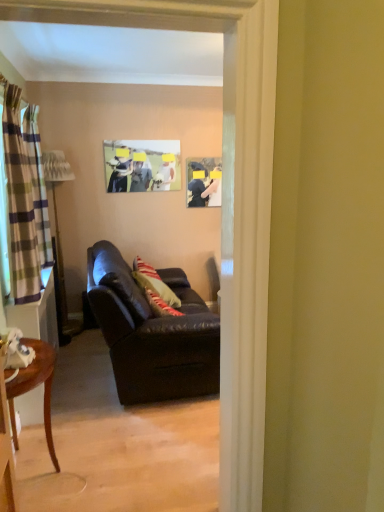
Question: Should I look upward or downward to see matte plastic picture frame at upper center, the second picture frame positioned from the right?

Choices:
 (A) up
 (B) down

Answer: (A)

Question: Is plaid fabric curtain at left, positioned as the 1th curtain in left-to-right order, aimed at mahogany wood side table at lower left?

Choices:
 (A) yes
 (B) no

Answer: (B)

Question: Is plaid fabric curtain at left, which is counted as the 1th curtain, starting from the back, far from mahogany wood side table at lower left?

Choices:
 (A) yes
 (B) no

Answer: (B)

Question: Is plaid fabric curtain at left, positioned as the 2th curtain in front-to-back order, smaller than mahogany wood side table at lower left?

Choices:
 (A) yes
 (B) no

Answer: (A)

Question: From the image's perspective, would you say plaid fabric curtain at left, positioned as the 1th curtain in left-to-right order, is positioned over mahogany wood side table at lower left?

Choices:
 (A) no
 (B) yes

Answer: (B)

Question: Considering the relative sizes of plaid fabric curtain at left, positioned as the 2th curtain in front-to-back order, and mahogany wood side table at lower left in the image provided, is plaid fabric curtain at left, positioned as the 2th curtain in front-to-back order, wider than mahogany wood side table at lower left?

Choices:
 (A) yes
 (B) no

Answer: (B)

Question: Does plaid fabric curtain at left, positioned as the 1th curtain in left-to-right order, come in front of mahogany wood side table at lower left?

Choices:
 (A) yes
 (B) no

Answer: (B)

Question: Is the position of matte plastic picture frame at upper center, the second picture frame positioned from the right, more distant than that of leather couch at center?

Choices:
 (A) no
 (B) yes

Answer: (B)

Question: From a real-world perspective, is matte plastic picture frame at upper center, which is the first picture frame in left-to-right order, positioned over leather couch at center based on gravity?

Choices:
 (A) no
 (B) yes

Answer: (B)

Question: Is matte plastic picture frame at upper center, the second picture frame positioned from the right, aimed at leather couch at center?

Choices:
 (A) yes
 (B) no

Answer: (B)

Question: Considering the relative positions of matte plastic picture frame at upper center, the second picture frame positioned from the right, and leather couch at center in the image provided, is matte plastic picture frame at upper center, the second picture frame positioned from the right, to the right of leather couch at center from the viewer's perspective?

Choices:
 (A) yes
 (B) no

Answer: (B)

Question: Is matte plastic picture frame at upper center, which is the first picture frame in left-to-right order, taller than leather couch at center?

Choices:
 (A) yes
 (B) no

Answer: (B)

Question: Is matte plastic picture frame at upper center, which is the first picture frame in left-to-right order, not within leather couch at center?

Choices:
 (A) no
 (B) yes

Answer: (B)

Question: Does leather couch at center come behind matte plastic picture frame at upper center, the second picture frame positioned from the right?

Choices:
 (A) no
 (B) yes

Answer: (A)